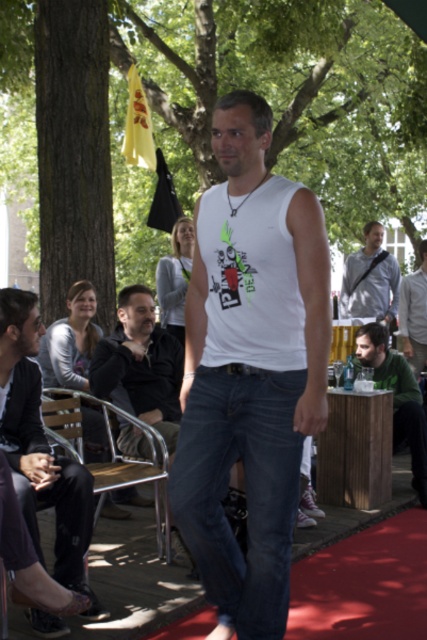
Between point (248, 390) and point (411, 307), which one is positioned behind?

The point (411, 307) is more distant.

Can you confirm if white matte tank top at center is wider than white matte shirt at center?

Yes.

Is point (271, 529) positioned behind point (415, 339)?

No, it is not.

Find the location of a particular element. white matte tank top at center is located at coordinates (249, 369).

Is dark gray jeans at lower left shorter than light blue shirt at center?

No.

Consider the image. Measure the distance between point (32,362) and camera.

Point (32,362) and camera are 4.13 meters apart.

The height and width of the screenshot is (640, 427). I want to click on dark gray jeans at lower left, so click(x=40, y=449).

Does dark blue denim jeans at center come in front of woodenchair at left?

Yes, dark blue denim jeans at center is closer to the viewer.

Is point (259, 508) less distant than point (155, 515)?

Yes, it is in front of point (155, 515).

Image resolution: width=427 pixels, height=640 pixels. In order to click on dark blue denim jeans at center in this screenshot , I will do `click(245, 490)`.